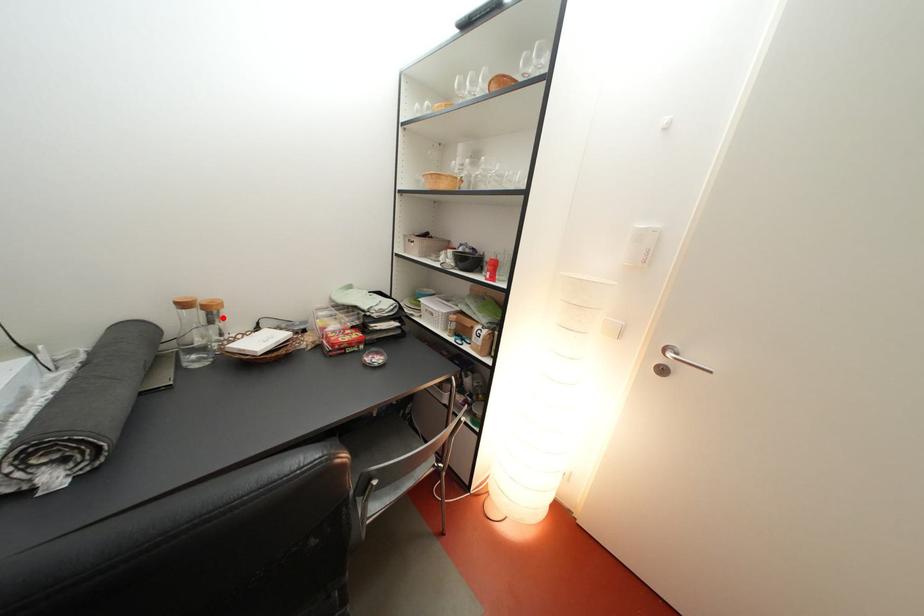
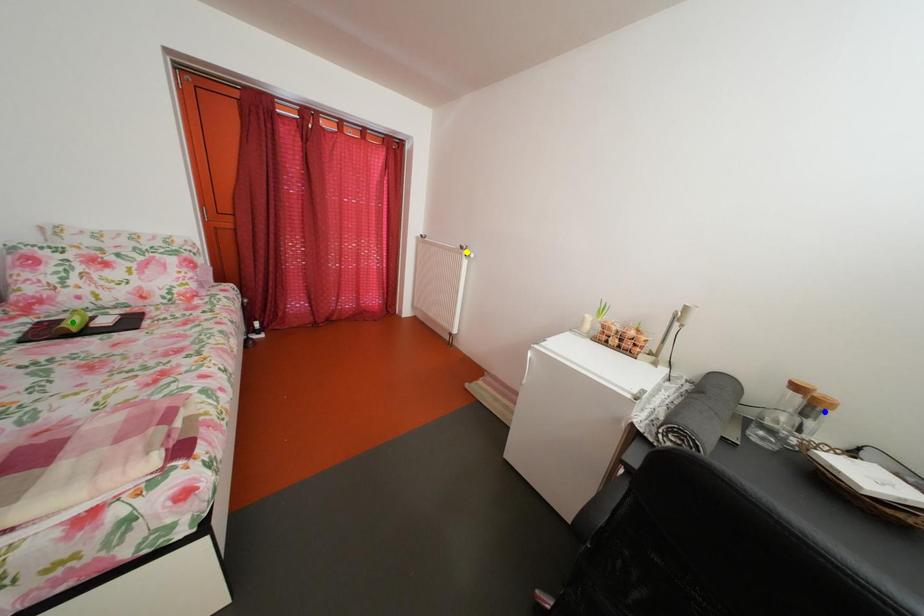
Question: I am providing you with two images of the same scene from different viewpoints. A red point is marked on the first image. You are given multiple points on the second image. Which spot in image 2 lines up with the point in image 1?

Choices:
 (A) green point
 (B) yellow point
 (C) blue point

Answer: (C)